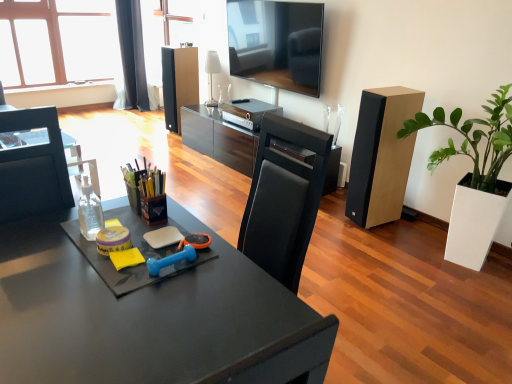
This screenshot has height=384, width=512. Find the location of `unoccupied area in front of yellow sponge at center`. unoccupied area in front of yellow sponge at center is located at coordinates (95, 274).